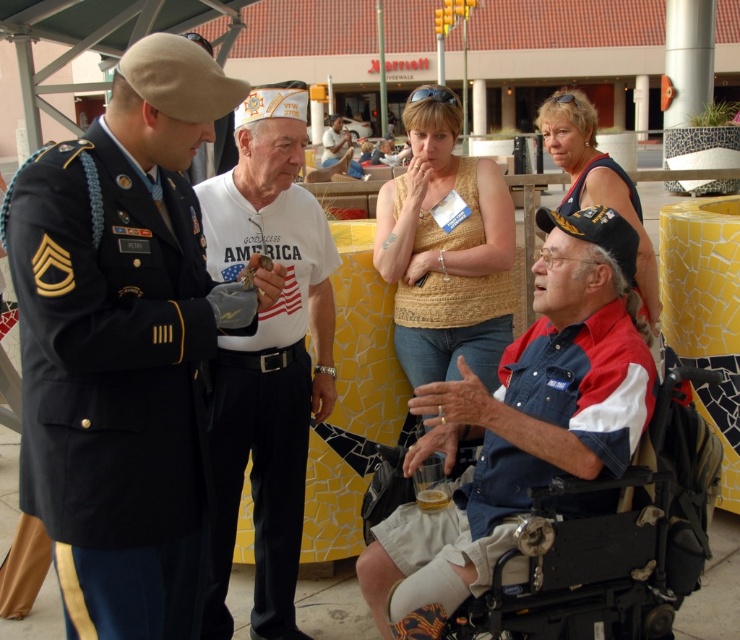
Question: Does navy blue fabric uniform at left have a lesser width compared to beige textured tank top at center?

Choices:
 (A) yes
 (B) no

Answer: (A)

Question: Which of the following is the farthest from the observer?

Choices:
 (A) (511, 602)
 (B) (648, 420)
 (C) (645, 250)

Answer: (C)

Question: Which point is closer to the camera taking this photo?

Choices:
 (A) (445, 492)
 (B) (437, 449)

Answer: (B)

Question: Which object is farther from the camera taking this photo?

Choices:
 (A) black plastic wheelchair at lower right
 (B) navy blue fabric uniform at left
 (C) white cotton t-shirt at center
 (D) white matte t-shirt at center

Answer: (D)

Question: Does white cotton t-shirt at center appear on the left side of white matte t-shirt at center?

Choices:
 (A) no
 (B) yes

Answer: (A)

Question: Does white matte t-shirt at center have a greater width compared to translucent plastic cup at lower center?

Choices:
 (A) yes
 (B) no

Answer: (A)